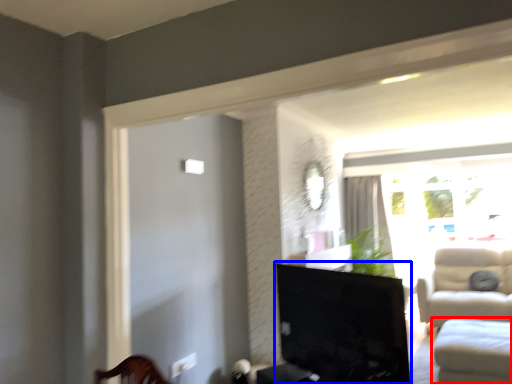
Question: Among these objects, which one is nearest to the camera, studio couch (highlighted by a red box) or furniture (highlighted by a blue box)?

Choices:
 (A) studio couch
 (B) furniture

Answer: (B)